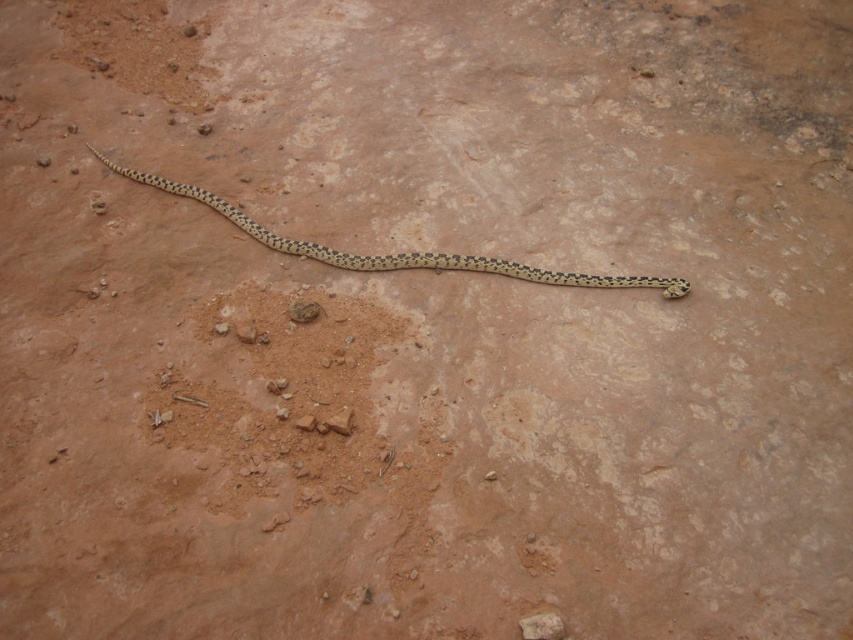
Question: From the image, what is the correct spatial relationship of speckled skin snake at center in relation to brown rough rock at center?

Choices:
 (A) right
 (B) left

Answer: (A)

Question: Does speckled skin snake at center come in front of brown rough rock at center?

Choices:
 (A) yes
 (B) no

Answer: (B)

Question: Which of the following is the farthest from the observer?

Choices:
 (A) brown rough rock at center
 (B) speckled skin snake at center

Answer: (B)

Question: Which object is closer to the camera taking this photo?

Choices:
 (A) brown rough rock at center
 (B) speckled skin snake at center

Answer: (A)

Question: Does speckled skin snake at center come behind brown rough rock at center?

Choices:
 (A) no
 (B) yes

Answer: (B)